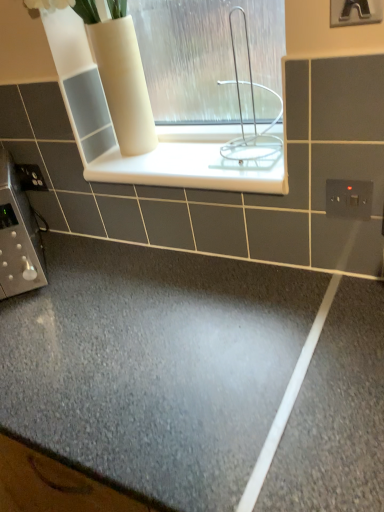
The width and height of the screenshot is (384, 512). What are the coordinates of `vacant space underneath white wire rack at center (from a real-world perspective)` in the screenshot? It's located at (246, 168).